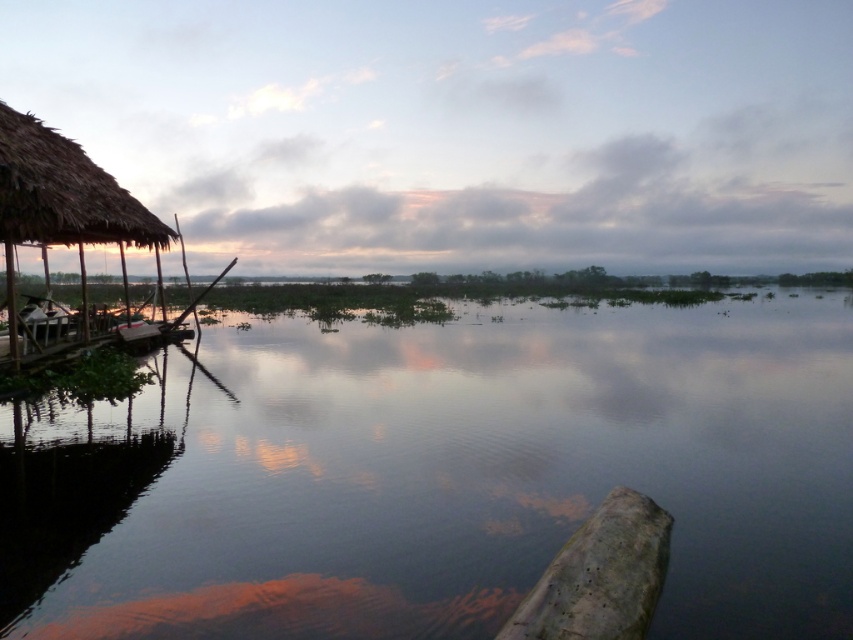
Does transparent water at center appear under thatched straw hut at left?

Yes, transparent water at center is below thatched straw hut at left.

Is transparent water at center wider than thatched straw hut at left?

Correct, the width of transparent water at center exceeds that of thatched straw hut at left.

Is point (604, 481) closer to viewer compared to point (67, 180)?

Yes, point (604, 481) is closer to viewer.

Locate an element on the screen. transparent water at center is located at coordinates (461, 472).